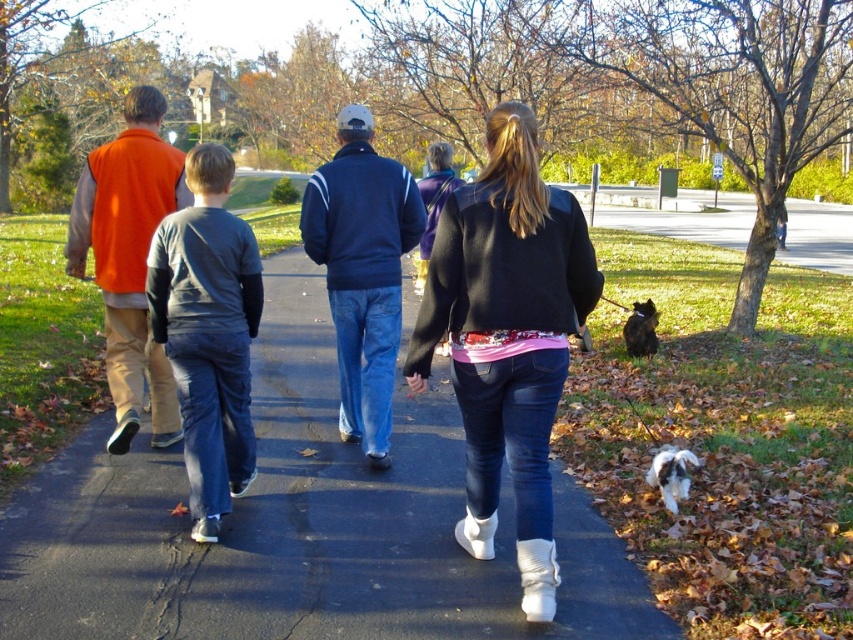
You are a photographer trying to capture a photo of the white fluffy dog at lower right and the black fur dog at lower right. Which dog should you focus on if you want to capture the one that takes up more space in the photo?

The black fur dog at lower right takes up more space in the photo because it has a greater width than the white fluffy dog at lower right.

What is the coordinate of the black asphalt pavement at center?

The coordinate of the black asphalt pavement at center is at point (299, 525).